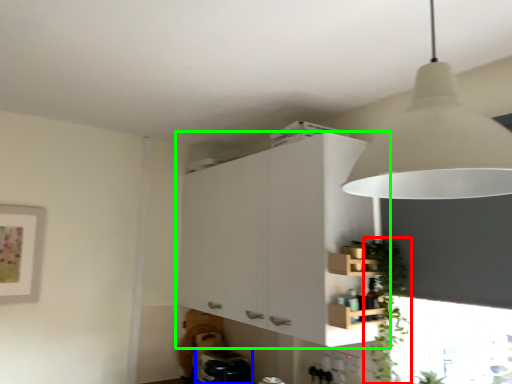
Question: Which object is the closest to the plant (highlighted by a red box)? Choose among these: appliance (highlighted by a blue box) or cabinetry (highlighted by a green box).

Choices:
 (A) appliance
 (B) cabinetry

Answer: (B)